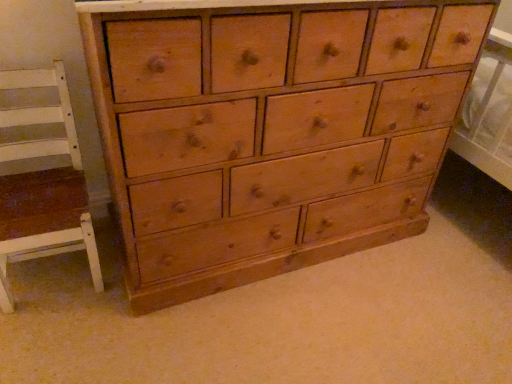
At what (x,y) coordinates should I click in order to perform the action: click on vacant space underneath white painted wood chair at left (from a real-world perspective). Please return your answer as a coordinate pair (x, y). The width and height of the screenshot is (512, 384). Looking at the image, I should click on (51, 274).